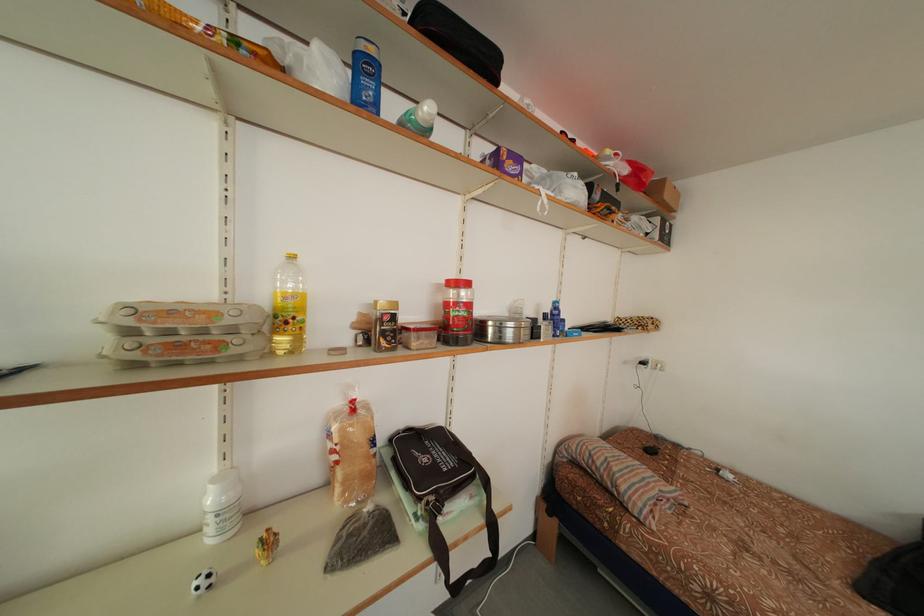
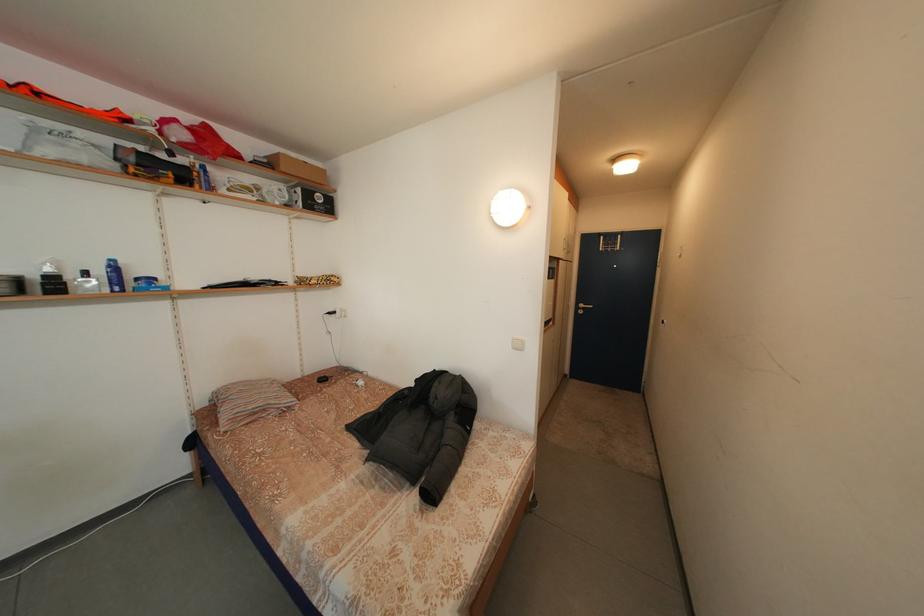
Locate, in the second image, the point that corresponds to (664,225) in the first image.

(307, 196)